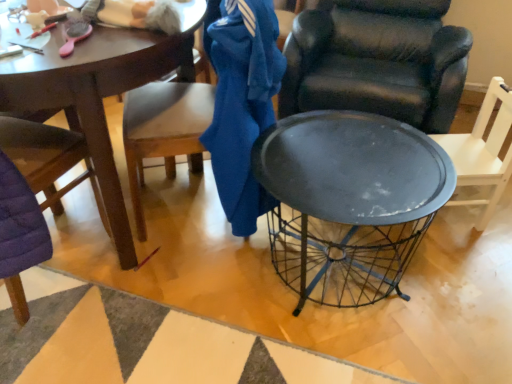
The image size is (512, 384). I want to click on free space that is in between purple quilted chair at left, the 1th chair when ordered from left to right, and metallic wire basket at center, so click(75, 325).